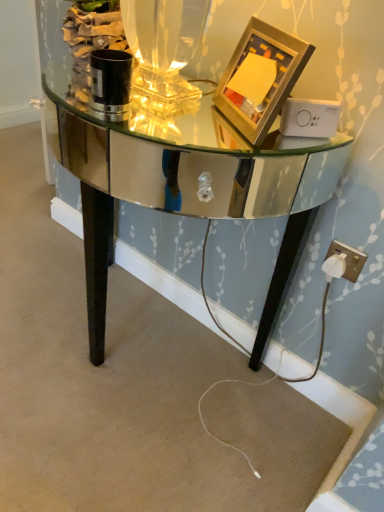
Question: Is white plastic plug at lower right positioned behind gold metallic picture frame at upper right?

Choices:
 (A) no
 (B) yes

Answer: (B)

Question: Is white plastic plug at lower right positioned with its back to gold metallic picture frame at upper right?

Choices:
 (A) yes
 (B) no

Answer: (B)

Question: Is white plastic plug at lower right in contact with gold metallic picture frame at upper right?

Choices:
 (A) no
 (B) yes

Answer: (A)

Question: Is white plastic plug at lower right completely or partially outside of gold metallic picture frame at upper right?

Choices:
 (A) no
 (B) yes

Answer: (B)

Question: Does white plastic plug at lower right turn towards gold metallic picture frame at upper right?

Choices:
 (A) no
 (B) yes

Answer: (A)

Question: Does white plastic plug at lower right come in front of gold metallic picture frame at upper right?

Choices:
 (A) yes
 (B) no

Answer: (B)

Question: Can you confirm if gold metallic picture frame at upper right is taller than white plastic plug at lower right?

Choices:
 (A) yes
 (B) no

Answer: (A)

Question: From a real-world perspective, is gold metallic picture frame at upper right positioned under white plastic plug at lower right based on gravity?

Choices:
 (A) no
 (B) yes

Answer: (A)

Question: Considering the relative sizes of gold metallic picture frame at upper right and white plastic plug at lower right in the image provided, is gold metallic picture frame at upper right smaller than white plastic plug at lower right?

Choices:
 (A) yes
 (B) no

Answer: (B)

Question: Is gold metallic picture frame at upper right to the right of white plastic plug at lower right from the viewer's perspective?

Choices:
 (A) yes
 (B) no

Answer: (B)

Question: Can you confirm if gold metallic picture frame at upper right is bigger than white plastic plug at lower right?

Choices:
 (A) yes
 (B) no

Answer: (A)

Question: Is there a large distance between gold metallic picture frame at upper right and white plastic plug at lower right?

Choices:
 (A) no
 (B) yes

Answer: (A)

Question: Is mirrored glass table at center aimed at white plastic plug at lower right?

Choices:
 (A) no
 (B) yes

Answer: (A)